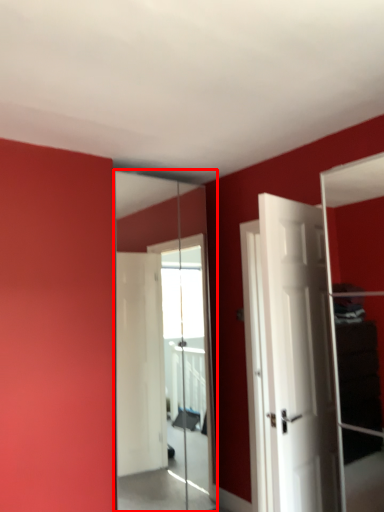
Question: In this image, where is mirror (annotated by the red box) located relative to door?

Choices:
 (A) right
 (B) left

Answer: (B)